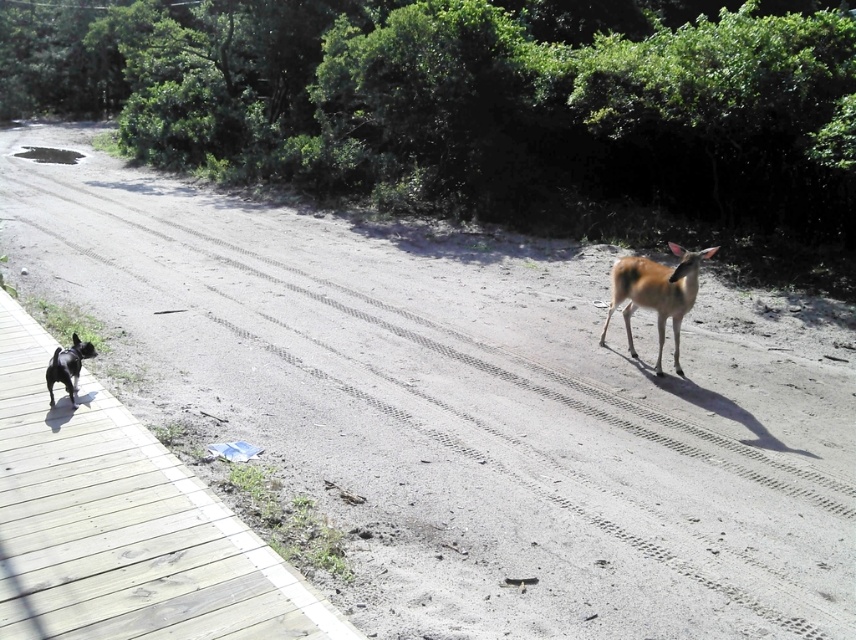
In the scene shown: Can you confirm if brown matte/deer at center-right is shorter than black glossy french bulldog at left?

No.

Does brown matte/deer at center-right have a greater height compared to black glossy french bulldog at left?

Correct, brown matte/deer at center-right is much taller as black glossy french bulldog at left.

This screenshot has height=640, width=856. Describe the element at coordinates (657, 294) in the screenshot. I see `brown matte/deer at center-right` at that location.

Find the location of a particular element. brown matte/deer at center-right is located at coordinates (657, 294).